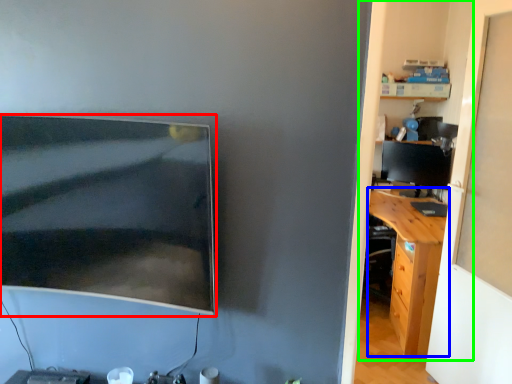
Question: Which object is positioned farthest from computer monitor (highlighted by a red box)? Select from desk (highlighted by a blue box) and dresser (highlighted by a green box).

Choices:
 (A) desk
 (B) dresser

Answer: (B)